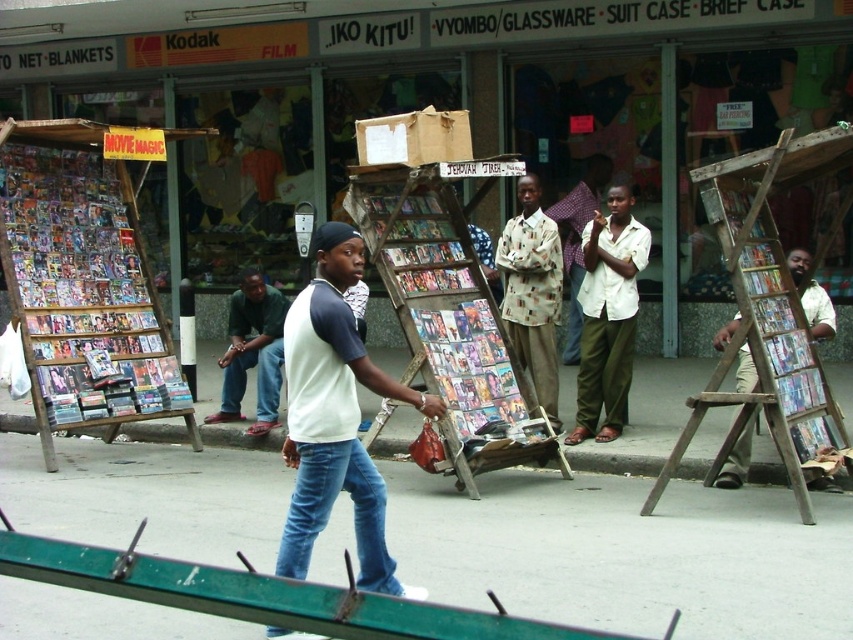
Does wooden at right appear over green fabric pants at center?

Correct, wooden at right is located above green fabric pants at center.

Who is more forward, (776, 148) or (247, 365)?

Positioned in front is point (776, 148).

Identify the location of wooden at right. (767, 310).

Identify the location of wooden at right. (767, 310).

What do you see at coordinates (532, 292) in the screenshot? This screenshot has width=853, height=640. I see `printed cotton shirt at center` at bounding box center [532, 292].

Between point (525, 360) and point (265, 416), which one is positioned in front?

Point (525, 360)

Where is `printed cotton shirt at center`? The image size is (853, 640). printed cotton shirt at center is located at coordinates (532, 292).

Is white cotton shirt at center taller than printed cotton shirt at center?

In fact, white cotton shirt at center may be shorter than printed cotton shirt at center.

Which is more to the left, white cotton shirt at center or printed cotton shirt at center?

white cotton shirt at center is more to the left.

Is point (370, 464) less distant than point (556, 234)?

Yes, it is in front of point (556, 234).

Identify the location of white cotton shirt at center. The height and width of the screenshot is (640, 853). (335, 417).